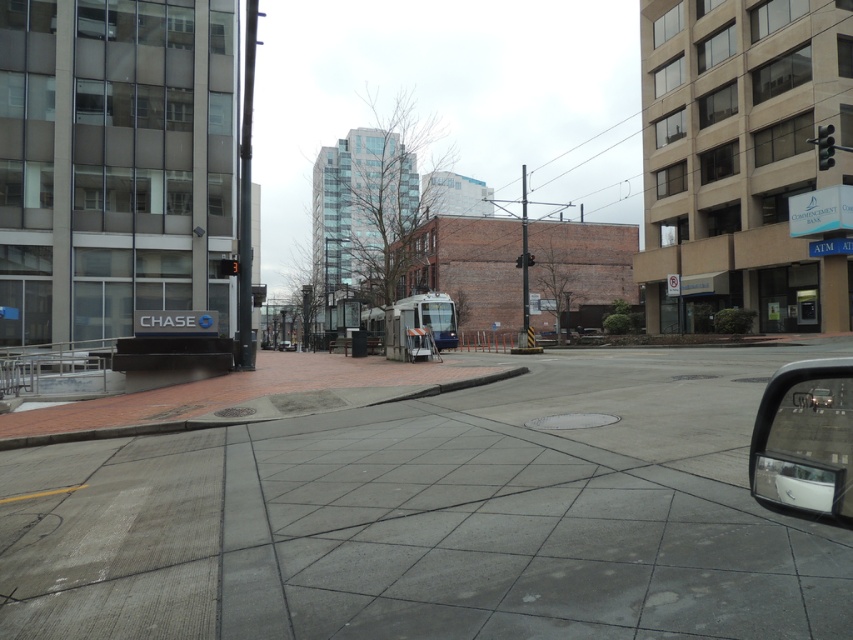
Question: Is concrete sidewalk at center positioned at the back of metallic pole at center?

Choices:
 (A) no
 (B) yes

Answer: (A)

Question: Is yellow matte traffic light at upper center further to the viewer compared to matte black car at center?

Choices:
 (A) yes
 (B) no

Answer: (B)

Question: Which point is closer to the camera taking this photo?

Choices:
 (A) (824, 403)
 (B) (833, 509)
 (C) (531, 259)

Answer: (B)

Question: Can you confirm if white glossy car at right is positioned to the right of metallic pole at center?

Choices:
 (A) yes
 (B) no

Answer: (B)

Question: Considering the real-world distances, which object is farthest from the red glass traffic light at center?

Choices:
 (A) yellow matte traffic light at upper center
 (B) metallic traffic light at upper right
 (C) concrete sidewalk at center
 (D) matte black car at center

Answer: (D)

Question: Which object is closer to the camera taking this photo?

Choices:
 (A) white glossy car at right
 (B) concrete sidewalk at center
 (C) metallic pole at center

Answer: (A)